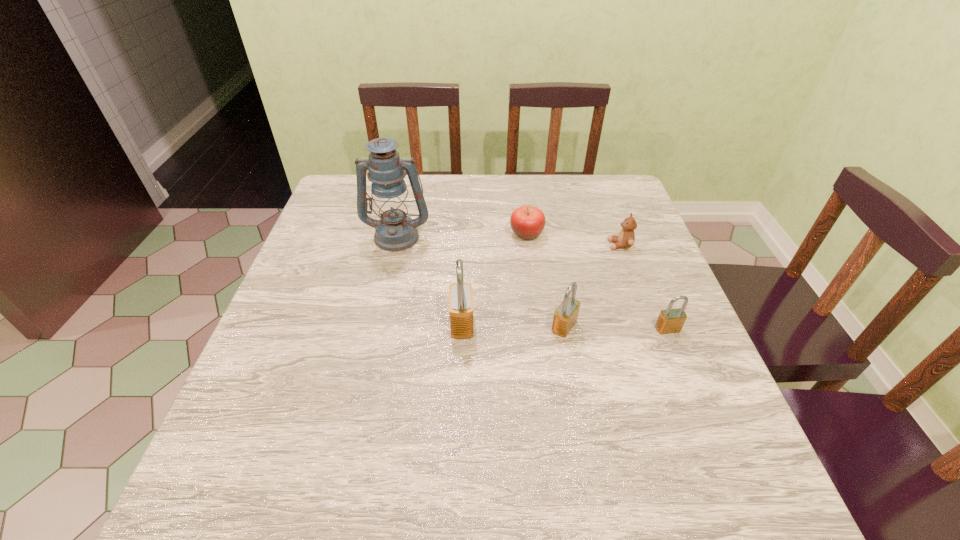
Given the evenly spaced padlocks in the image, where should an extra padlock be added on the left to preserve the spacing? Please point to a vacant space. Please provide its 2D coordinates. Your answer should be formatted as a tuple, i.e. [(x, y)], where the tuple contains the x and y coordinates of a point satisfying the conditions above.

[(361, 321)]